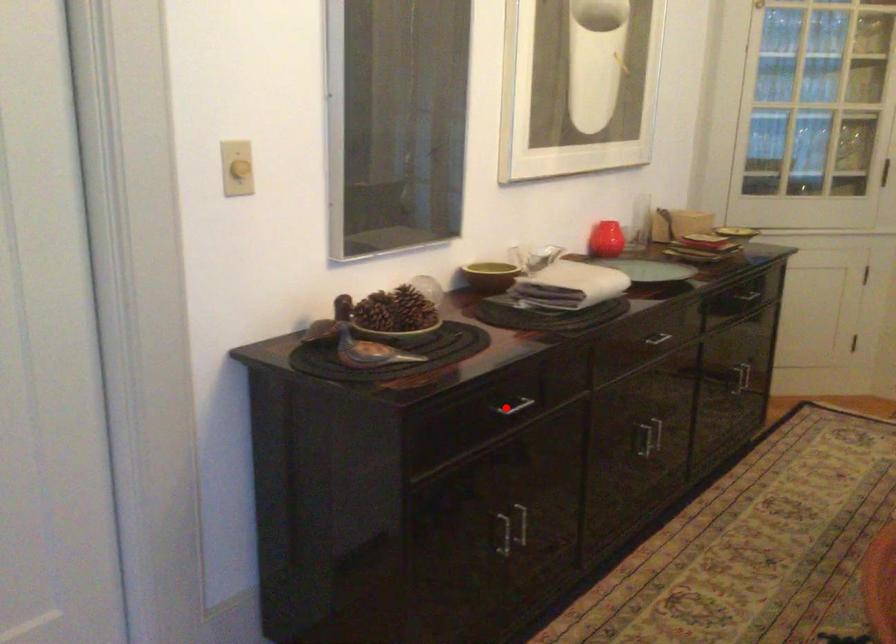
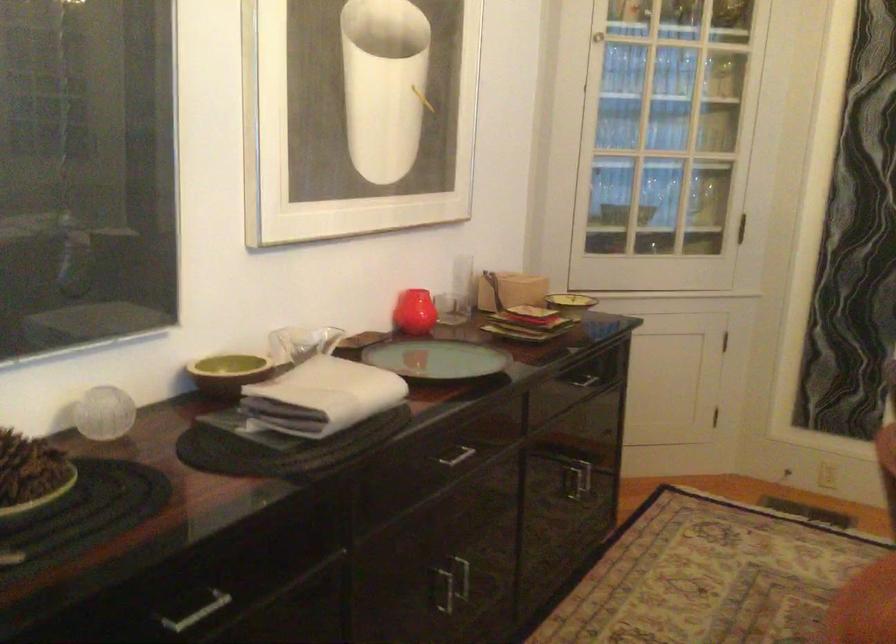
Locate, in the second image, the point that corresponds to the highlighted location in the first image.

(194, 609)